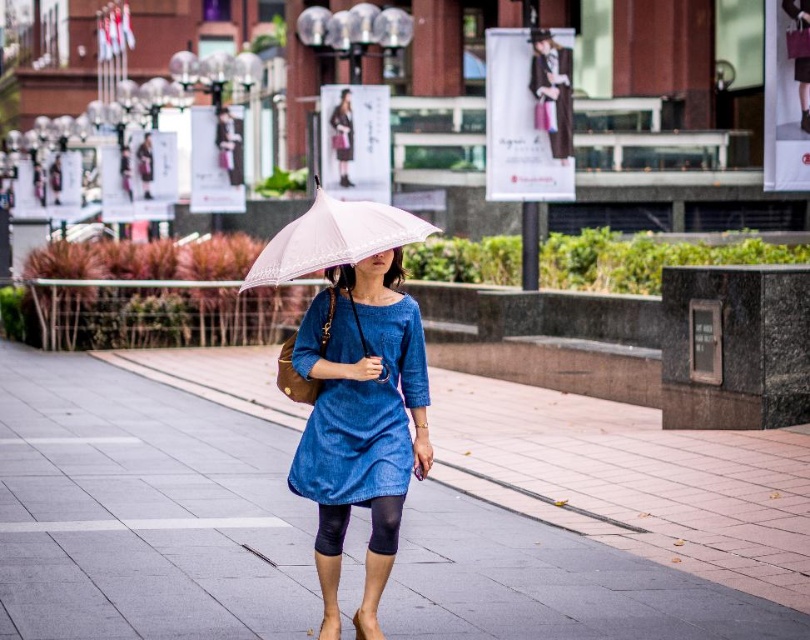
You are standing at the point with coordinates point (391, 380) and want to walk to the point with coordinates point (378, 508). According to the scene, is the destination point in front of or behind you?

The destination point with coordinates point (378, 508) is in front of you because the starting point point (391, 380) is behind point (378, 508).

You are a fashion photographer who wants to capture the denim dress at center and the white lace umbrella at center in a single frame. Given that your camera can only focus on one object at a time, which object should you prioritize to ensure it fills the frame more effectively?

The denim dress at center is bigger than the white lace umbrella at center, so prioritizing the denim dress at center will allow it to fill the frame more effectively.